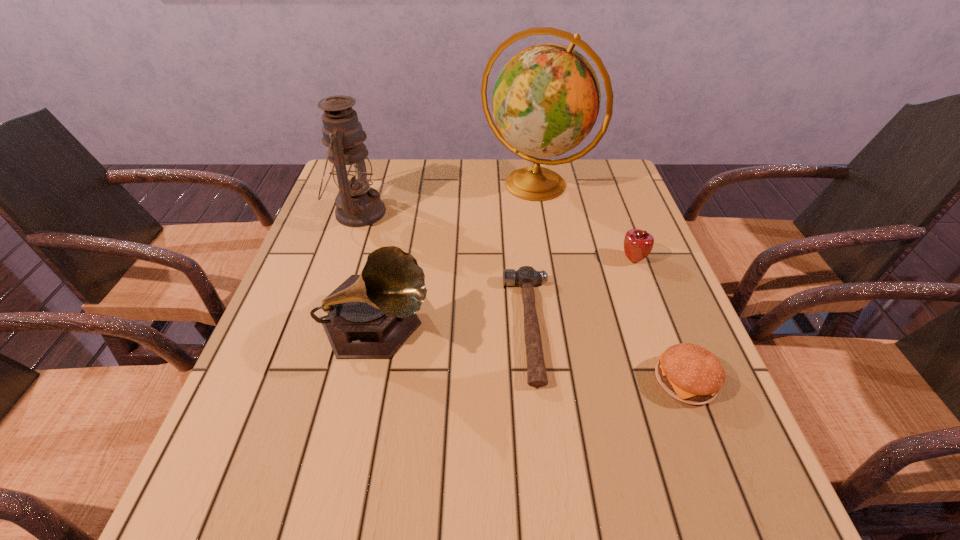
Find the location of a particular element. The height and width of the screenshot is (540, 960). vacant space at the near right corner of the desktop is located at coordinates (724, 498).

The image size is (960, 540). What are the coordinates of `free point between the oil lamp and the globe` in the screenshot? It's located at (446, 199).

At what (x,y) coordinates should I click in order to perform the action: click on unoccupied position between the phonograph record and the third farthest object. Please return your answer as a coordinate pair (x, y). The width and height of the screenshot is (960, 540). Looking at the image, I should click on (505, 294).

At what (x,y) coordinates should I click in order to perform the action: click on vacant space that is in between the globe and the hamburger. Please return your answer as a coordinate pair (x, y). This screenshot has width=960, height=540. Looking at the image, I should click on (611, 283).

Locate an element on the screen. The image size is (960, 540). free spot between the shortest object and the third shortest object is located at coordinates (582, 293).

Identify the location of vacant area that lies between the globe and the hammer. point(533,256).

Find the location of a particular element. Image resolution: width=960 pixels, height=540 pixels. empty location between the phonograph record and the hammer is located at coordinates click(x=453, y=328).

Where is `vacant area that lies between the fourth tallest object and the oil lamp`? vacant area that lies between the fourth tallest object and the oil lamp is located at coordinates (495, 236).

You are a GUI agent. You are given a task and a screenshot of the screen. Output one action in this format:
    pyautogui.click(x=<x>, y=<y>)
    Task: Click on the object that can be found as the second closest to the globe
    
    Given the screenshot: What is the action you would take?
    pyautogui.click(x=526, y=277)

Identify which object is the fifth nearest to the tallest object. Please provide its 2D coordinates. Your answer should be formatted as a tuple, i.e. [(x, y)], where the tuple contains the x and y coordinates of a point satisfying the conditions above.

[(688, 372)]